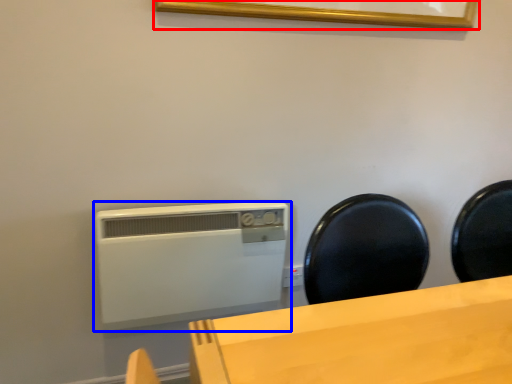
Question: Which of the following is the closest to the observer, picture frame (highlighted by a red box) or home appliance (highlighted by a blue box)?

Choices:
 (A) picture frame
 (B) home appliance

Answer: (A)